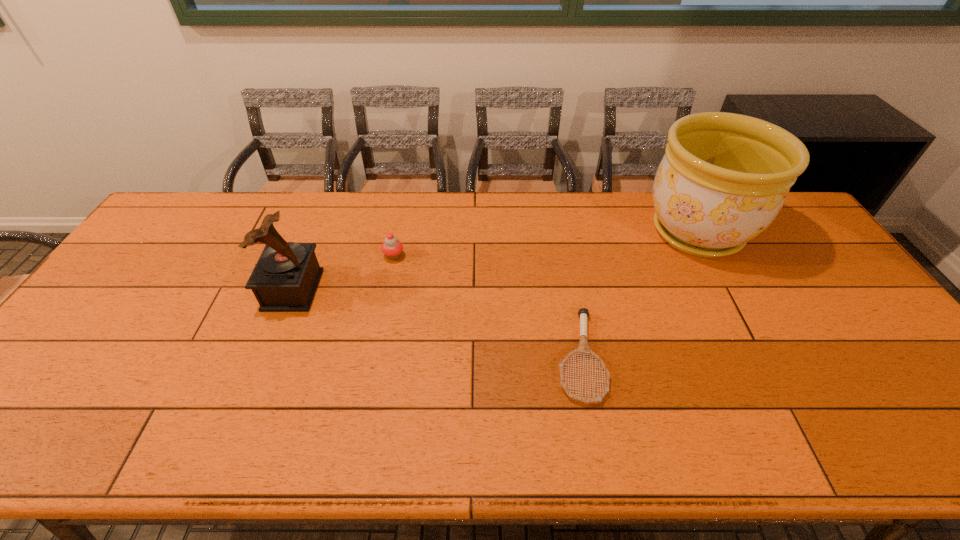
I want to click on free point between the flowerpot and the leftmost object, so click(x=494, y=261).

You are a GUI agent. You are given a task and a screenshot of the screen. Output one action in this format:
    pyautogui.click(x=<x>, y=<y>)
    Task: Click on the empty space that is in between the phonograph_record and the tallest object
    
    Given the screenshot: What is the action you would take?
    pyautogui.click(x=494, y=261)

Locate an element on the screen. This screenshot has height=540, width=960. free space between the rightmost object and the nearest object is located at coordinates (638, 294).

Locate an element on the screen. vacant region between the tennis racket and the third tallest object is located at coordinates (487, 306).

You are a GUI agent. You are given a task and a screenshot of the screen. Output one action in this format:
    pyautogui.click(x=<x>, y=<y>)
    Task: Click on the empty location between the rightmost object and the cupcake
    
    Given the screenshot: What is the action you would take?
    pyautogui.click(x=545, y=244)

This screenshot has height=540, width=960. What are the coordinates of `free space between the third object from right to left and the flowerpot` in the screenshot? It's located at (545, 244).

In order to click on vacant region between the phonograph_record and the rightmost object in this screenshot , I will do `click(494, 261)`.

At what (x,y) coordinates should I click in order to perform the action: click on vacant area that lies between the cupcake and the shortest object. Please return your answer as a coordinate pair (x, y). Looking at the image, I should click on (487, 306).

Select which object is the second closest to the flowerpot. Please provide its 2D coordinates. Your answer should be formatted as a tuple, i.e. [(x, y)], where the tuple contains the x and y coordinates of a point satisfying the conditions above.

[(392, 248)]

What are the coordinates of `object that is the third closest to the cupcake` in the screenshot? It's located at (724, 178).